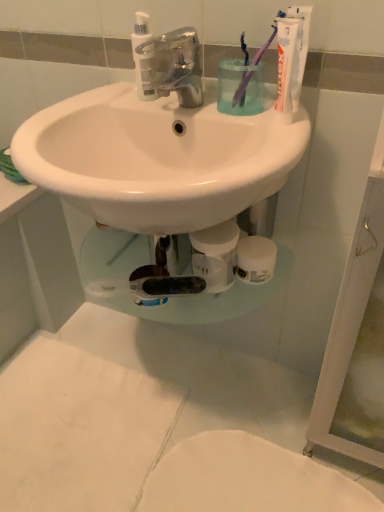
Question: Is translucent plastic pump bottle at upper center taller than chrome metallic faucet at center?

Choices:
 (A) yes
 (B) no

Answer: (A)

Question: Is translucent plastic pump bottle at upper center oriented away from chrome metallic faucet at center?

Choices:
 (A) no
 (B) yes

Answer: (A)

Question: From a real-world perspective, does translucent plastic pump bottle at upper center sit lower than chrome metallic faucet at center?

Choices:
 (A) yes
 (B) no

Answer: (B)

Question: Is chrome metallic faucet at center completely or partially inside translucent plastic pump bottle at upper center?

Choices:
 (A) yes
 (B) no

Answer: (B)

Question: Can you confirm if translucent plastic pump bottle at upper center is positioned to the right of chrome metallic faucet at center?

Choices:
 (A) no
 (B) yes

Answer: (A)

Question: Is translucent plastic pump bottle at upper center outside chrome metallic faucet at center?

Choices:
 (A) yes
 (B) no

Answer: (A)

Question: From the image's perspective, is purple plastic toothbrush at upper right, the 2th toothbrush positioned from the left, located above purple plastic toothbrush at upper center, arranged as the second toothbrush when viewed from the right?

Choices:
 (A) yes
 (B) no

Answer: (A)

Question: From a real-world perspective, is purple plastic toothbrush at upper right, which is counted as the 1th toothbrush, starting from the right, physically below purple plastic toothbrush at upper center, arranged as the second toothbrush when viewed from the right?

Choices:
 (A) yes
 (B) no

Answer: (B)

Question: Is the position of purple plastic toothbrush at upper right, the 2th toothbrush positioned from the left, less distant than that of purple plastic toothbrush at upper center, which ranks as the first toothbrush in left-to-right order?

Choices:
 (A) yes
 (B) no

Answer: (A)

Question: From the image's perspective, would you say purple plastic toothbrush at upper right, the 2th toothbrush positioned from the left, is shown under purple plastic toothbrush at upper center, arranged as the second toothbrush when viewed from the right?

Choices:
 (A) no
 (B) yes

Answer: (A)

Question: Would you say purple plastic toothbrush at upper right, which is counted as the 1th toothbrush, starting from the right, is outside purple plastic toothbrush at upper center, arranged as the second toothbrush when viewed from the right?

Choices:
 (A) no
 (B) yes

Answer: (B)

Question: Is purple plastic toothbrush at upper right, the 2th toothbrush positioned from the left, facing towards purple plastic toothbrush at upper center, which ranks as the first toothbrush in left-to-right order?

Choices:
 (A) no
 (B) yes

Answer: (A)

Question: From a real-world perspective, is purple plastic toothbrush at upper right, the 2th toothbrush positioned from the left, below chrome metallic faucet at center?

Choices:
 (A) no
 (B) yes

Answer: (A)